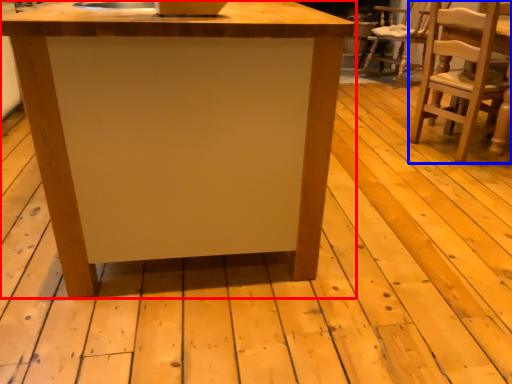
Question: Which object is closer to the camera taking this photo, table (highlighted by a red box) or chair (highlighted by a blue box)?

Choices:
 (A) table
 (B) chair

Answer: (A)